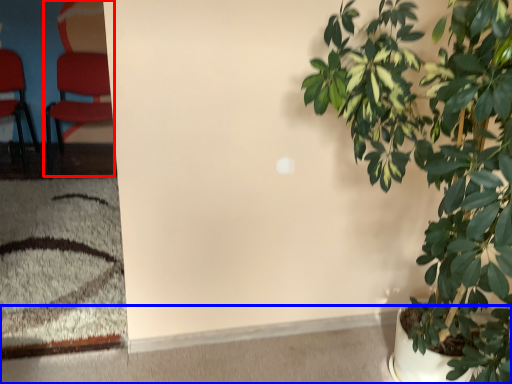
Question: Which object is closer to the camera taking this photo, chair (highlighted by a red box) or concrete (highlighted by a blue box)?

Choices:
 (A) chair
 (B) concrete

Answer: (B)